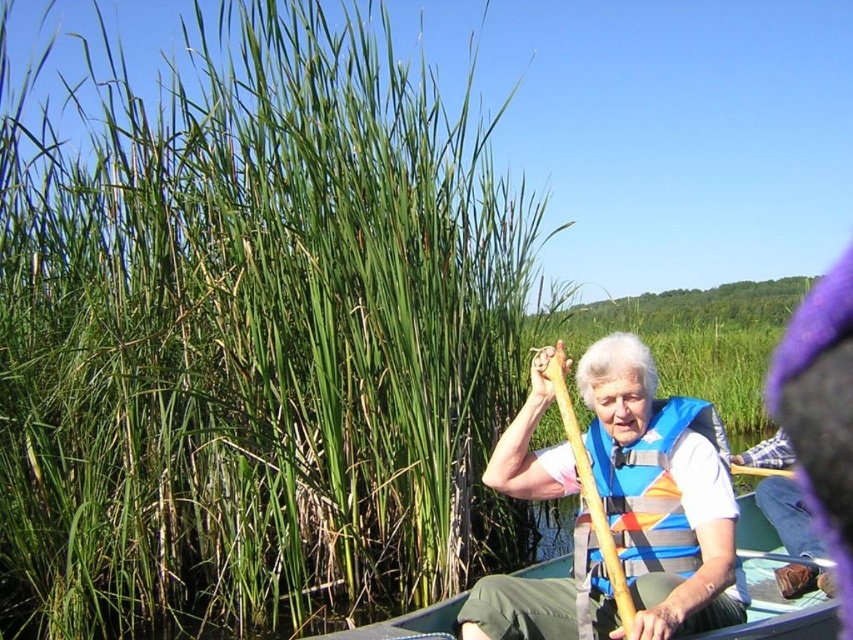
You are an observer standing on the shore looking at the scene. Which object, the green grass at upper left or the wooden paddle at center, is taller?

The green grass at upper left is taller than the wooden paddle at center.

You are standing on the green grass at upper left and want to reach the green plastic canoe at center. Which direction should you move to get there?

You should move to the right because the green grass at upper left is to the left of the green plastic canoe at center, so moving right will take you towards the canoe.